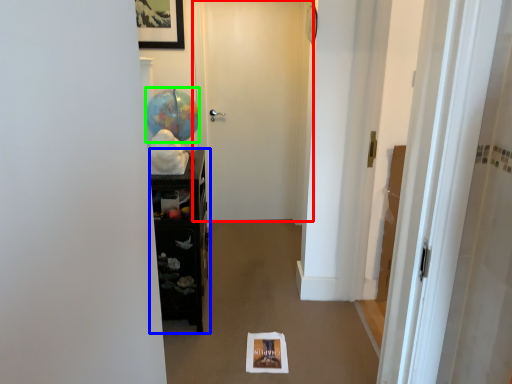
Question: Considering the real-world distances, which object is farthest from door (highlighted by a red box)? furniture (highlighted by a blue box) or balloon (highlighted by a green box)?

Choices:
 (A) furniture
 (B) balloon

Answer: (A)